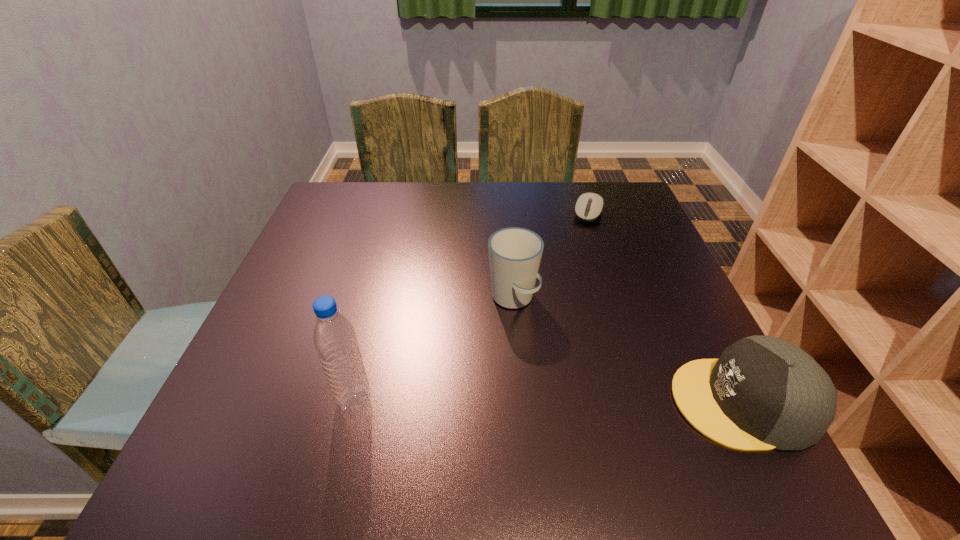
What are the coordinates of `empty space that is in between the third tallest object and the computer equipment` in the screenshot? It's located at (666, 307).

This screenshot has height=540, width=960. I want to click on free space between the farthest object and the cap, so click(666, 307).

You are a GUI agent. You are given a task and a screenshot of the screen. Output one action in this format:
    pyautogui.click(x=<x>, y=<y>)
    Task: Click on the unoccupied position between the tallest object and the computer equipment
    
    Given the screenshot: What is the action you would take?
    pyautogui.click(x=471, y=307)

Locate an element on the screen. free area in between the tallest object and the shortest object is located at coordinates (471, 307).

Locate an element on the screen. free space that is in between the leftmost object and the shortest object is located at coordinates (471, 307).

Locate an element on the screen. This screenshot has height=540, width=960. unoccupied position between the computer equipment and the second shortest object is located at coordinates (666, 307).

Locate an element on the screen. The height and width of the screenshot is (540, 960). empty location between the farthest object and the second shortest object is located at coordinates (666, 307).

Identify the location of empty space between the second tallest object and the water bottle. (434, 349).

Where is `blank region between the cap and the shortest object`? This screenshot has height=540, width=960. blank region between the cap and the shortest object is located at coordinates (666, 307).

Identify the location of free space between the tallest object and the farthest object. (471, 307).